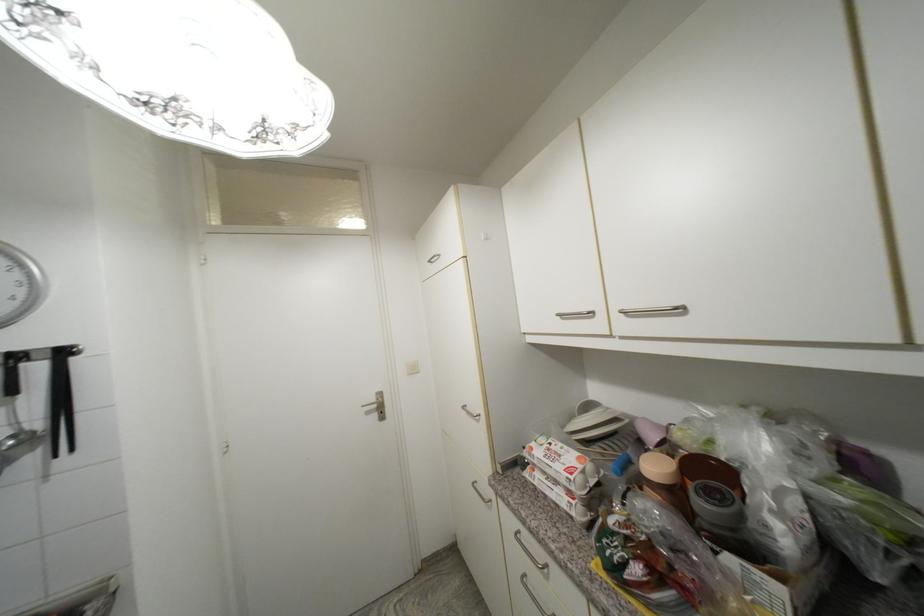
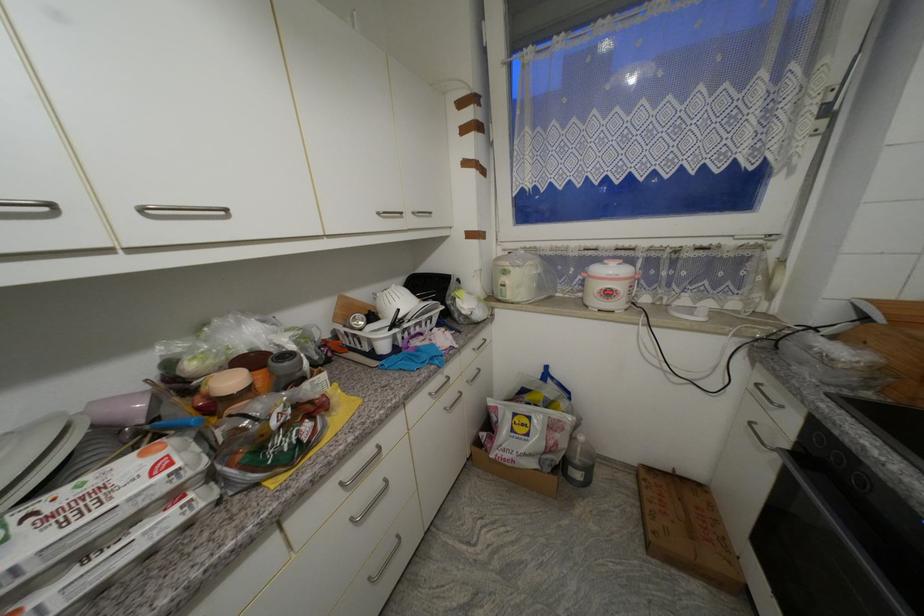
Where in the second image is the point corresponding to (x=584, y=460) from the first image?

(149, 456)